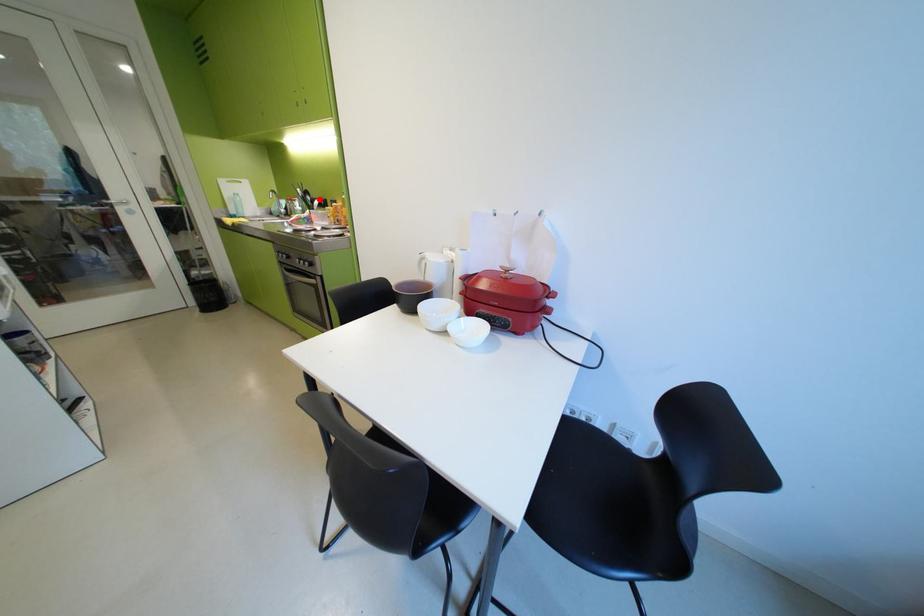
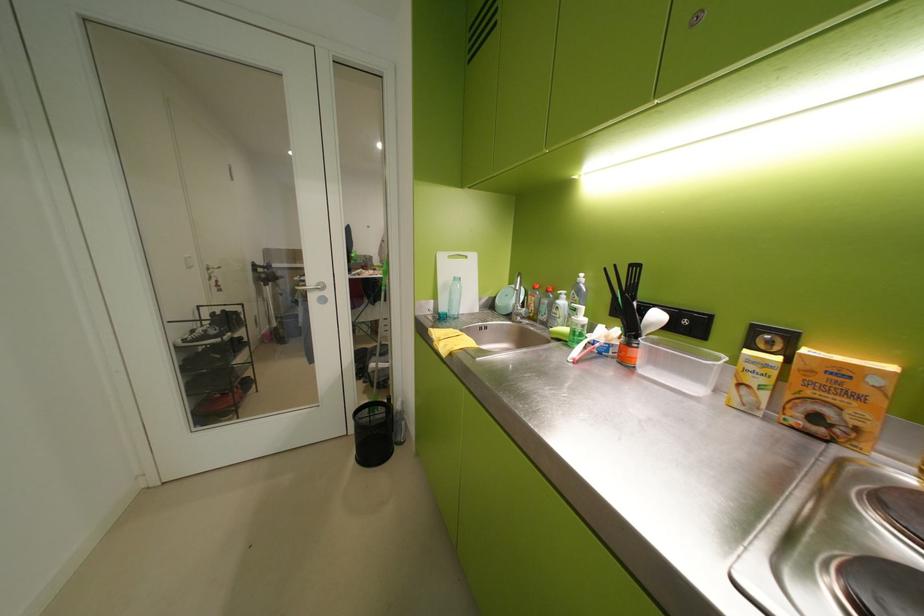
Question: I am providing you with two images of the same scene from different viewpoints. A red point is marked on the first image. At the location where the point appears in image 1, is it still visible in image 2?

Choices:
 (A) Yes
 (B) No

Answer: (A)